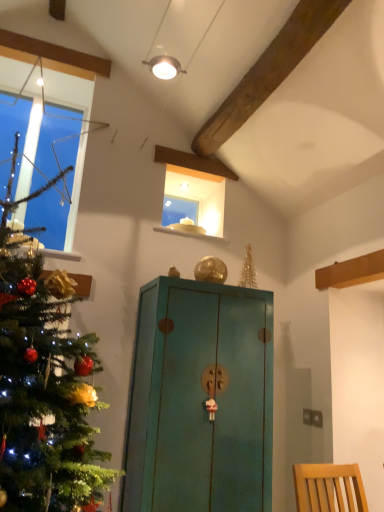
Locate an element on the screen. free spot above clear glass window at left (from a real-world perspective) is located at coordinates (57, 102).